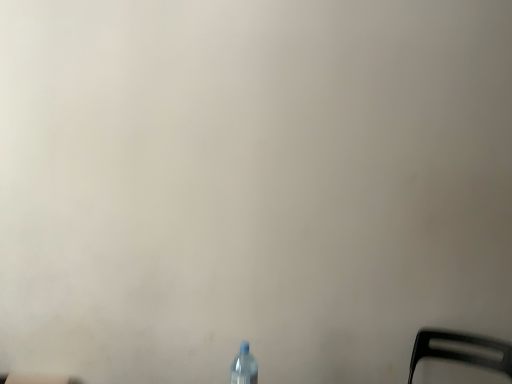
This screenshot has width=512, height=384. I want to click on transparent plastic bottle at lower center, so click(x=244, y=367).

Image resolution: width=512 pixels, height=384 pixels. What do you see at coordinates (244, 367) in the screenshot? I see `transparent plastic bottle at lower center` at bounding box center [244, 367].

What is the approximate width of transparent plastic bottle at lower center?

It is 10.01 centimeters.

What do you see at coordinates (462, 351) in the screenshot?
I see `black plastic chair at lower right` at bounding box center [462, 351].

The width and height of the screenshot is (512, 384). I want to click on black plastic chair at lower right, so click(x=462, y=351).

Where is `transparent plastic bottle at lower center`? The width and height of the screenshot is (512, 384). transparent plastic bottle at lower center is located at coordinates (244, 367).

Can you confirm if black plastic chair at lower right is positioned to the right of transparent plastic bottle at lower center?

Yes, black plastic chair at lower right is to the right of transparent plastic bottle at lower center.

Which object is closer to the camera taking this photo, black plastic chair at lower right or transparent plastic bottle at lower center?

transparent plastic bottle at lower center is in front.

Between point (487, 357) and point (245, 365), which one is positioned in front?

Point (245, 365)

From the image's perspective, relative to transparent plastic bottle at lower center, is black plastic chair at lower right above or below?

black plastic chair at lower right is below transparent plastic bottle at lower center.

From a real-world perspective, between black plastic chair at lower right and transparent plastic bottle at lower center, who is vertically lower?

black plastic chair at lower right.

Between black plastic chair at lower right and transparent plastic bottle at lower center, which one has larger width?

black plastic chair at lower right.

Looking at this image, considering the relative sizes of black plastic chair at lower right and transparent plastic bottle at lower center in the image provided, is black plastic chair at lower right taller than transparent plastic bottle at lower center?

No.

Considering the relative sizes of black plastic chair at lower right and transparent plastic bottle at lower center in the image provided, is black plastic chair at lower right smaller than transparent plastic bottle at lower center?

Incorrect, black plastic chair at lower right is not smaller in size than transparent plastic bottle at lower center.

Can we say black plastic chair at lower right lies outside transparent plastic bottle at lower center?

Absolutely, black plastic chair at lower right is external to transparent plastic bottle at lower center.

Is there a large distance between black plastic chair at lower right and transparent plastic bottle at lower center?

Indeed, black plastic chair at lower right is not near transparent plastic bottle at lower center.

Is black plastic chair at lower right looking in the opposite direction of transparent plastic bottle at lower center?

No, black plastic chair at lower right is not facing away from transparent plastic bottle at lower center.

How different are the orientations of black plastic chair at lower right and transparent plastic bottle at lower center in degrees?

There is a 127-degree angle between the facing directions of black plastic chair at lower right and transparent plastic bottle at lower center.

Locate an element on the screen. chair on the right of transparent plastic bottle at lower center is located at coordinates (462, 351).

Is transparent plastic bottle at lower center at the left side of black plastic chair at lower right?

Correct, you'll find transparent plastic bottle at lower center to the left of black plastic chair at lower right.

Is the position of transparent plastic bottle at lower center more distant than that of black plastic chair at lower right?

No, transparent plastic bottle at lower center is closer to the viewer.

Does point (247, 376) appear closer or farther from the camera than point (477, 340)?

Point (247, 376) is positioned closer to the camera compared to point (477, 340).

From the image's perspective, is transparent plastic bottle at lower center positioned above or below black plastic chair at lower right?

Based on their image positions, transparent plastic bottle at lower center is located above black plastic chair at lower right.

From a real-world perspective, between transparent plastic bottle at lower center and black plastic chair at lower right, who is vertically lower?

black plastic chair at lower right, from a real-world perspective.

Is transparent plastic bottle at lower center thinner than black plastic chair at lower right?

Correct, the width of transparent plastic bottle at lower center is less than that of black plastic chair at lower right.

Between transparent plastic bottle at lower center and black plastic chair at lower right, which one has less height?

black plastic chair at lower right.

From the picture: Between transparent plastic bottle at lower center and black plastic chair at lower right, which one has smaller size?

Smaller between the two is transparent plastic bottle at lower center.

Would you say black plastic chair at lower right is part of transparent plastic bottle at lower center's contents?

Definitely not — black plastic chair at lower right is not inside transparent plastic bottle at lower center.

Is transparent plastic bottle at lower center beside black plastic chair at lower right?

No, transparent plastic bottle at lower center is not next to black plastic chair at lower right.

Is transparent plastic bottle at lower center aimed at black plastic chair at lower right?

Yes, transparent plastic bottle at lower center faces towards black plastic chair at lower right.

How many degrees apart are the facing directions of transparent plastic bottle at lower center and black plastic chair at lower right?

transparent plastic bottle at lower center and black plastic chair at lower right are facing 127 degrees away from each other.

How far apart are transparent plastic bottle at lower center and black plastic chair at lower right?

transparent plastic bottle at lower center is 3.68 feet from black plastic chair at lower right.

The height and width of the screenshot is (384, 512). I want to click on bottle on the left of black plastic chair at lower right, so click(244, 367).

Find the location of a particular element. Image resolution: width=512 pixels, height=384 pixels. chair on the right of transparent plastic bottle at lower center is located at coordinates (462, 351).

Image resolution: width=512 pixels, height=384 pixels. Find the location of `bottle lying on the left of black plastic chair at lower right`. bottle lying on the left of black plastic chair at lower right is located at coordinates (244, 367).